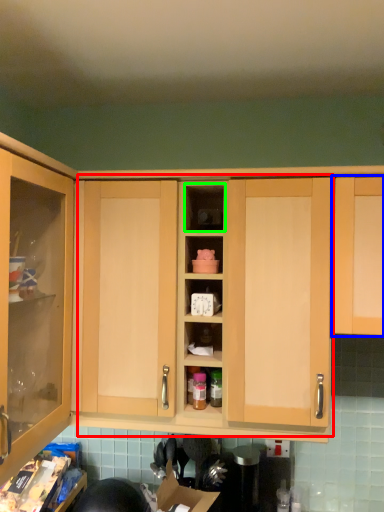
Question: Which is farther away from dresser (highlighted by a red box)? cabinetry (highlighted by a blue box) or cabinet (highlighted by a green box)?

Choices:
 (A) cabinetry
 (B) cabinet

Answer: (B)